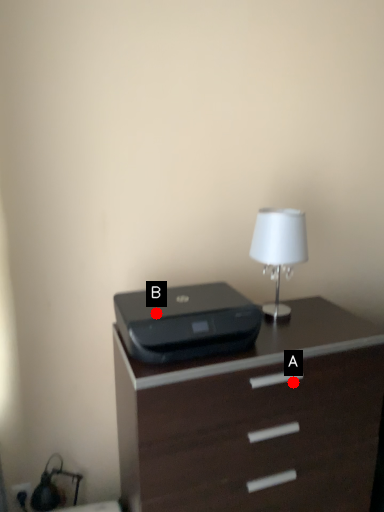
Question: Two points are circled on the image, labeled by A and B beside each circle. Which of the following is the farthest from the observer?

Choices:
 (A) A is further
 (B) B is further

Answer: (B)